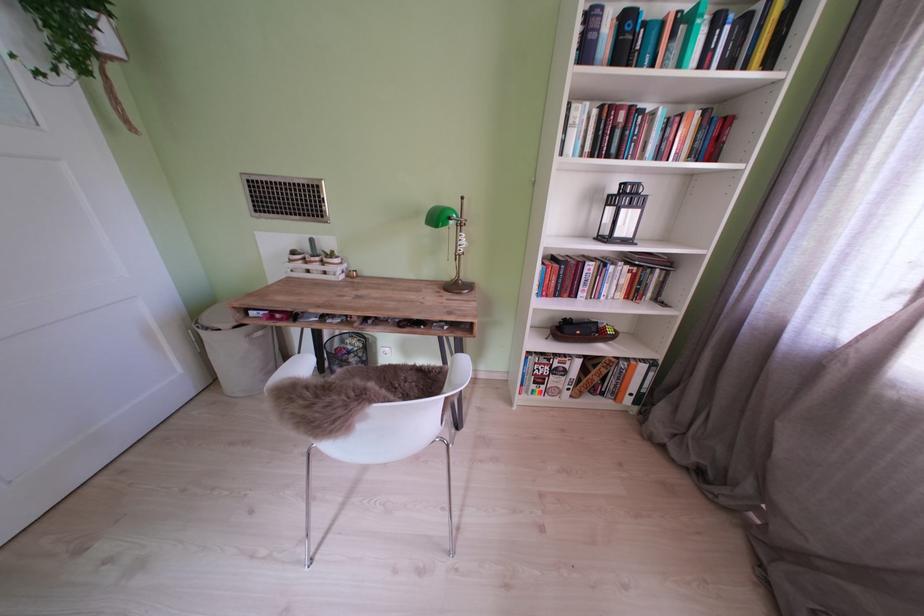
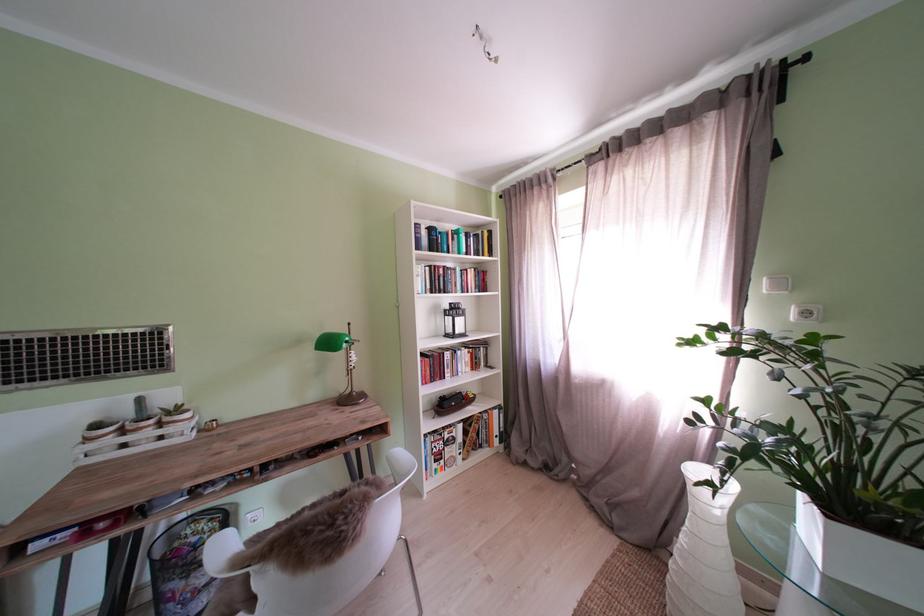
Where in the second image is the point corresponding to point (366, 347) from the first image?

(213, 530)